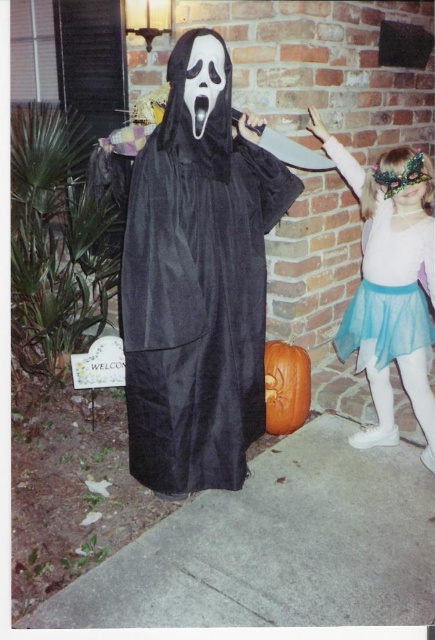
Is translucent blue skirt at right further to the viewer compared to light blue tulle skirt at right?

No, it is not.

Which is in front, point (428, 394) or point (357, 332)?

Positioned in front is point (428, 394).

Is point (348, 337) positioned after point (387, 362)?

That is True.

Identify the location of translucent blue skirt at right. (385, 221).

Is velvet black ghost at center behind translucent blue skirt at right?

No, it is in front of translucent blue skirt at right.

The height and width of the screenshot is (640, 435). What do you see at coordinates (197, 280) in the screenshot? I see `velvet black ghost at center` at bounding box center [197, 280].

Where is `velvet black ghost at center`? velvet black ghost at center is located at coordinates (197, 280).

Can you confirm if translucent blue skirt at right is positioned to the right of orange matte pumpkin at center?

Indeed, translucent blue skirt at right is positioned on the right side of orange matte pumpkin at center.

In the scene shown: Which is above, translucent blue skirt at right or orange matte pumpkin at center?

translucent blue skirt at right is higher up.

At what (x,y) coordinates should I click in order to perform the action: click on translucent blue skirt at right. Please return your answer as a coordinate pair (x, y). Looking at the image, I should click on (385, 221).